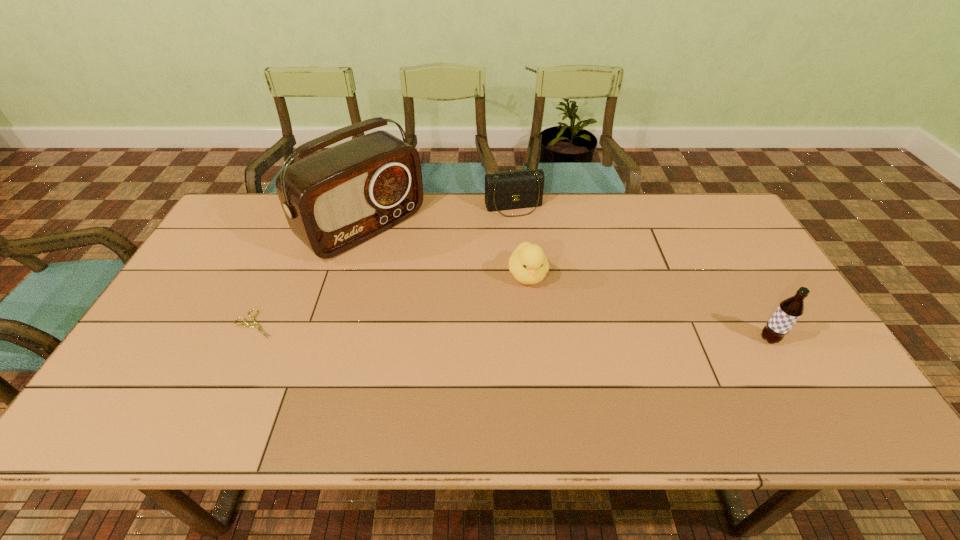
This screenshot has width=960, height=540. Find the location of `vacant space at the far edge of the desktop`. vacant space at the far edge of the desktop is located at coordinates (632, 225).

Locate an element on the screen. Image resolution: width=960 pixels, height=540 pixels. vacant region at the near edge is located at coordinates (253, 381).

Locate an element on the screen. This screenshot has height=540, width=960. vacant region at the left edge of the desktop is located at coordinates (254, 239).

This screenshot has width=960, height=540. In the image, there is a desktop. In order to click on vacant space at the right edge in this screenshot , I will do `click(737, 278)`.

Where is `free space at the far left corner of the desktop`? This screenshot has height=540, width=960. free space at the far left corner of the desktop is located at coordinates (268, 198).

Image resolution: width=960 pixels, height=540 pixels. Identify the location of vacant space at the near left corner. (160, 381).

Identify the location of empty space between the tallest object and the duck. (445, 251).

Find the location of a particular element. This screenshot has height=540, width=960. free space that is in between the clutch bag and the shortest object is located at coordinates (384, 266).

Find the location of a particular element. This screenshot has width=960, height=540. free spot between the clutch bag and the shortest object is located at coordinates (384, 266).

This screenshot has width=960, height=540. Identify the location of vacant space that is in between the duck and the tallest object. (445, 251).